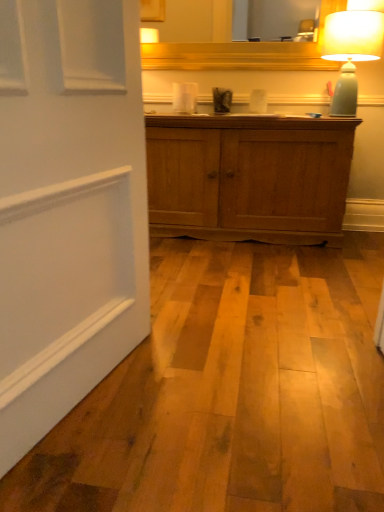
What is the approximate width of matte green ceramic lampshade at upper right?

10.93 inches.

Describe the element at coordinates (351, 52) in the screenshot. I see `matte green ceramic lampshade at upper right` at that location.

Locate an element on the screen. The height and width of the screenshot is (512, 384). matte green ceramic lampshade at upper right is located at coordinates (351, 52).

Locate an element on the screen. wooden mirror at upper center is located at coordinates (240, 49).

In order to face wooden mirror at upper center, should I rotate leftwards or rightwards?

You should look right and rotate roughly 9.642 degrees.

The width and height of the screenshot is (384, 512). What do you see at coordinates (240, 49) in the screenshot?
I see `wooden mirror at upper center` at bounding box center [240, 49].

Identify the location of matte green ceramic lampshade at upper right. This screenshot has height=512, width=384. (351, 52).

Between wooden mirror at upper center and matte green ceramic lampshade at upper right, which one appears on the right side from the viewer's perspective?

matte green ceramic lampshade at upper right.

Which object is further away from the camera, wooden mirror at upper center or matte green ceramic lampshade at upper right?

wooden mirror at upper center is further away from the camera.

Which is in front, point (308, 49) or point (354, 19)?

The point (354, 19) is closer.

From the image's perspective, which is below, wooden mirror at upper center or matte green ceramic lampshade at upper right?

From the image's view, matte green ceramic lampshade at upper right is below.

From a real-world perspective, does wooden mirror at upper center stand above matte green ceramic lampshade at upper right?

Yes, from a real-world perspective, wooden mirror at upper center is over matte green ceramic lampshade at upper right

Looking at their sizes, would you say wooden mirror at upper center is wider or thinner than matte green ceramic lampshade at upper right?

Considering their sizes, wooden mirror at upper center looks slimmer than matte green ceramic lampshade at upper right.

Is wooden mirror at upper center taller than matte green ceramic lampshade at upper right?

No.

Is wooden mirror at upper center smaller than matte green ceramic lampshade at upper right?

Yes, wooden mirror at upper center is smaller than matte green ceramic lampshade at upper right.

From the picture: Is matte green ceramic lampshade at upper right surrounded by wooden mirror at upper center?

No, matte green ceramic lampshade at upper right is not a part of wooden mirror at upper center.

Is wooden mirror at upper center far from matte green ceramic lampshade at upper right?

Actually, wooden mirror at upper center and matte green ceramic lampshade at upper right are a little close together.

Is wooden mirror at upper center positioned with its back to matte green ceramic lampshade at upper right?

No, wooden mirror at upper center's orientation is not away from matte green ceramic lampshade at upper right.

Can you tell me how much wooden mirror at upper center and matte green ceramic lampshade at upper right differ in facing direction?

The angular difference between wooden mirror at upper center and matte green ceramic lampshade at upper right is 0.322 degrees.

Measure the distance from wooden mirror at upper center to matte green ceramic lampshade at upper right.

wooden mirror at upper center is 13.89 inches from matte green ceramic lampshade at upper right.

Find the location of a particular element. This screenshot has height=512, width=384. table lamp lying in front of the wooden mirror at upper center is located at coordinates (351, 52).

Can you confirm if matte green ceramic lampshade at upper right is positioned to the left of wooden mirror at upper center?

In fact, matte green ceramic lampshade at upper right is to the right of wooden mirror at upper center.

Considering the positions of objects matte green ceramic lampshade at upper right and wooden mirror at upper center in the image provided, who is behind, matte green ceramic lampshade at upper right or wooden mirror at upper center?

wooden mirror at upper center is further from the camera.

Is point (334, 41) closer or farther from the camera than point (240, 66)?

Point (334, 41) appears to be closer to the viewer than point (240, 66).

In the scene shown: From the image's perspective, is matte green ceramic lampshade at upper right above or below wooden mirror at upper center?

From the image's perspective, matte green ceramic lampshade at upper right appears below wooden mirror at upper center.

From a real-world perspective, is matte green ceramic lampshade at upper right under wooden mirror at upper center?

Yes.

Which of these two, matte green ceramic lampshade at upper right or wooden mirror at upper center, is thinner?

wooden mirror at upper center.

Between matte green ceramic lampshade at upper right and wooden mirror at upper center, which one has less height?

With less height is wooden mirror at upper center.

Is matte green ceramic lampshade at upper right bigger than wooden mirror at upper center?

Indeed, matte green ceramic lampshade at upper right has a larger size compared to wooden mirror at upper center.

Is matte green ceramic lampshade at upper right not inside wooden mirror at upper center?

Yes, matte green ceramic lampshade at upper right is located beyond the bounds of wooden mirror at upper center.

Are matte green ceramic lampshade at upper right and wooden mirror at upper center located far from each other?

matte green ceramic lampshade at upper right is near wooden mirror at upper center, not far away.

Could you tell me if matte green ceramic lampshade at upper right is turned towards wooden mirror at upper center?

No, matte green ceramic lampshade at upper right is not facing towards wooden mirror at upper center.

How distant is matte green ceramic lampshade at upper right from wooden mirror at upper center?

13.89 inches.

Where is `mirror that appears above the matte green ceramic lampshade at upper right (from the image's perspective)`? mirror that appears above the matte green ceramic lampshade at upper right (from the image's perspective) is located at coordinates (240, 49).

This screenshot has height=512, width=384. In the image, there is a wooden mirror at upper center. Identify the location of table lamp below it (from the image's perspective). (351, 52).

This screenshot has height=512, width=384. Identify the location of mirror that is above the matte green ceramic lampshade at upper right (from the image's perspective). (240, 49).